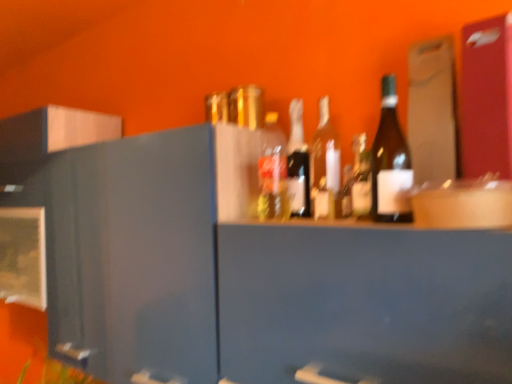
What do you see at coordinates (324, 164) in the screenshot? The height and width of the screenshot is (384, 512). I see `translucent glass bottle at center, which is counted as the 4th bottle, starting from the front` at bounding box center [324, 164].

Locate an element on the screen. matte glass bottle at center, positioned as the fifth bottle in back-to-front order is located at coordinates (361, 181).

The width and height of the screenshot is (512, 384). Identify the location of green glass bottle at upper right, positioned as the sixth bottle in back-to-front order. (390, 161).

Can you confirm if green glass bottle at upper right, positioned as the sixth bottle in back-to-front order, is thinner than matte glass bottle at center, positioned as the fifth bottle in back-to-front order?

Incorrect, the width of green glass bottle at upper right, positioned as the sixth bottle in back-to-front order, is not less than that of matte glass bottle at center, positioned as the fifth bottle in back-to-front order.

Is green glass bottle at upper right, positioned as the sixth bottle in back-to-front order, surrounding matte glass bottle at center, positioned as the 2th bottle in front-to-back order?

No, matte glass bottle at center, positioned as the 2th bottle in front-to-back order, is not inside green glass bottle at upper right, positioned as the sixth bottle in back-to-front order.

How many degrees apart are the facing directions of green glass bottle at upper right, the first bottle from the front, and matte glass bottle at center, positioned as the 2th bottle in front-to-back order?

The angular difference between green glass bottle at upper right, the first bottle from the front, and matte glass bottle at center, positioned as the 2th bottle in front-to-back order, is 4.16 degrees.

Between green glass bottle at upper right, positioned as the sixth bottle in back-to-front order, and matte glass bottle at center, positioned as the 2th bottle in front-to-back order, which one has larger size?

green glass bottle at upper right, positioned as the sixth bottle in back-to-front order.

From a real-world perspective, which is physically above, translucent glass bottle at center, the 2th bottle in the back-to-front sequence, or green glass bottle at upper right, positioned as the sixth bottle in back-to-front order?

green glass bottle at upper right, positioned as the sixth bottle in back-to-front order.

Which object is positioned more to the right, translucent glass bottle at center, placed as the 5th bottle when sorted from front to back, or green glass bottle at upper right, positioned as the sixth bottle in back-to-front order?

green glass bottle at upper right, positioned as the sixth bottle in back-to-front order.

Does point (259, 176) appear closer or farther from the camera than point (390, 97)?

Point (259, 176) is closer to the camera than point (390, 97).

Between translucent glass bottle at center, placed as the 5th bottle when sorted from front to back, and green glass bottle at upper right, the first bottle from the front, which one has larger size?

green glass bottle at upper right, the first bottle from the front.

From a real-world perspective, is translucent glass bottle at center, placed as the 3th bottle when sorted from back to front, beneath green glass bottle at upper right, the first bottle from the front?

No.

Consider the image. Which of these two, translucent glass bottle at center, which is counted as the 4th bottle, starting from the front, or green glass bottle at upper right, the first bottle from the front, stands taller?

Standing taller between the two is translucent glass bottle at center, which is counted as the 4th bottle, starting from the front.

What's the angular difference between translucent glass bottle at center, which is counted as the 4th bottle, starting from the front, and green glass bottle at upper right, the first bottle from the front,'s facing directions?

They differ by 4.22 degrees in their facing directions.

Is translucent glass bottle at center, placed as the 3th bottle when sorted from back to front, inside or outside of green glass bottle at upper right, the first bottle from the front?

translucent glass bottle at center, placed as the 3th bottle when sorted from back to front, lies outside green glass bottle at upper right, the first bottle from the front.

Is translucent glass bottle at center, the 2th bottle in the back-to-front sequence, facing away from matte glass bottle at center, which is counted as the third bottle, starting from the front?

No, translucent glass bottle at center, the 2th bottle in the back-to-front sequence, is not facing away from matte glass bottle at center, which is counted as the third bottle, starting from the front.

Which object is further away from the camera, translucent glass bottle at center, placed as the 5th bottle when sorted from front to back, or matte glass bottle at center, which is counted as the third bottle, starting from the front?

translucent glass bottle at center, placed as the 5th bottle when sorted from front to back, is further from the camera.

Which is behind, point (282, 194) or point (356, 138)?

Positioned behind is point (356, 138).

Considering the sizes of objects translucent glass bottle at center, the 6th bottle when ordered from front to back, and matte glass bottle at center, positioned as the fifth bottle in back-to-front order, in the image provided, who is shorter, translucent glass bottle at center, the 6th bottle when ordered from front to back, or matte glass bottle at center, positioned as the fifth bottle in back-to-front order,?

Standing shorter between the two is matte glass bottle at center, positioned as the fifth bottle in back-to-front order.

Is translucent glass bottle at center, the 6th bottle when ordered from front to back, to the right of matte glass bottle at center, positioned as the fifth bottle in back-to-front order, from the viewer's perspective?

Incorrect, translucent glass bottle at center, the 6th bottle when ordered from front to back, is not on the right side of matte glass bottle at center, positioned as the fifth bottle in back-to-front order.

Consider the image. Looking at their sizes, would you say translucent glass bottle at center, arranged as the 1th bottle when viewed from the back, is wider or thinner than matte glass bottle at center, positioned as the 2th bottle in front-to-back order?

Considering their sizes, translucent glass bottle at center, arranged as the 1th bottle when viewed from the back, looks broader than matte glass bottle at center, positioned as the 2th bottle in front-to-back order.

Which object is further away from the camera, translucent glass bottle at center, the 6th bottle when ordered from front to back, or matte glass bottle at center, positioned as the fifth bottle in back-to-front order?

translucent glass bottle at center, the 6th bottle when ordered from front to back.

From a real-world perspective, is matte glass bottle at center, positioned as the fifth bottle in back-to-front order, on top of translucent glass bottle at center, which is counted as the 4th bottle, starting from the front?

No, from a real-world perspective, matte glass bottle at center, positioned as the fifth bottle in back-to-front order, is not over translucent glass bottle at center, which is counted as the 4th bottle, starting from the front

Considering the relative sizes of matte glass bottle at center, positioned as the 2th bottle in front-to-back order, and translucent glass bottle at center, which is counted as the 4th bottle, starting from the front, in the image provided, is matte glass bottle at center, positioned as the 2th bottle in front-to-back order, wider than translucent glass bottle at center, which is counted as the 4th bottle, starting from the front,?

In fact, matte glass bottle at center, positioned as the 2th bottle in front-to-back order, might be narrower than translucent glass bottle at center, which is counted as the 4th bottle, starting from the front.

Which of these two, matte glass bottle at center, positioned as the 2th bottle in front-to-back order, or translucent glass bottle at center, placed as the 3th bottle when sorted from back to front, is smaller?

Smaller between the two is matte glass bottle at center, positioned as the 2th bottle in front-to-back order.

Based on their sizes in the image, would you say matte glass bottle at center, which is the fourth bottle from back to front, is bigger or smaller than matte glass bottle at center, positioned as the fifth bottle in back-to-front order?

Considering their sizes, matte glass bottle at center, which is the fourth bottle from back to front, takes up more space than matte glass bottle at center, positioned as the fifth bottle in back-to-front order.

Is matte glass bottle at center, which is counted as the third bottle, starting from the front, oriented away from matte glass bottle at center, positioned as the 2th bottle in front-to-back order?

No, matte glass bottle at center, positioned as the 2th bottle in front-to-back order, is not at the back of matte glass bottle at center, which is counted as the third bottle, starting from the front.

Is matte glass bottle at center, which is the fourth bottle from back to front, located outside matte glass bottle at center, positioned as the fifth bottle in back-to-front order?

That's correct, matte glass bottle at center, which is the fourth bottle from back to front, is outside of matte glass bottle at center, positioned as the fifth bottle in back-to-front order.

Locate an element on the screen. This screenshot has height=384, width=512. bottle in front of the matte glass bottle at center, positioned as the 2th bottle in front-to-back order is located at coordinates (390, 161).

Locate an element on the screen. The width and height of the screenshot is (512, 384). bottle that is the 2nd object located above the translucent glass bottle at center, the 2th bottle in the back-to-front sequence (from the image's perspective) is located at coordinates (390, 161).

Based on their spatial positions, is translucent glass bottle at center, placed as the 3th bottle when sorted from back to front, or matte glass bottle at center, positioned as the 2th bottle in front-to-back order, further from translucent glass bottle at center, placed as the 5th bottle when sorted from front to back?

Among the two, matte glass bottle at center, positioned as the 2th bottle in front-to-back order, is located further to translucent glass bottle at center, placed as the 5th bottle when sorted from front to back.

When comparing their distances from matte glass bottle at center, positioned as the 2th bottle in front-to-back order, does green glass bottle at upper right, positioned as the sixth bottle in back-to-front order, or matte glass bottle at center, which is counted as the third bottle, starting from the front, seem closer?

The object closer to matte glass bottle at center, positioned as the 2th bottle in front-to-back order, is matte glass bottle at center, which is counted as the third bottle, starting from the front.

Looking at the image, which one is located further to translucent glass bottle at center, the 2th bottle in the back-to-front sequence, translucent glass bottle at center, placed as the 3th bottle when sorted from back to front, or green glass bottle at upper right, the first bottle from the front?

Among the two, green glass bottle at upper right, the first bottle from the front, is located further to translucent glass bottle at center, the 2th bottle in the back-to-front sequence.

Based on the photo, considering their positions, is green glass bottle at upper right, the first bottle from the front, positioned further to translucent glass bottle at center, placed as the 5th bottle when sorted from front to back, than matte glass bottle at center, positioned as the fifth bottle in back-to-front order?

The object further to translucent glass bottle at center, placed as the 5th bottle when sorted from front to back, is green glass bottle at upper right, the first bottle from the front.

Which object lies further to the anchor point matte glass bottle at center, positioned as the fifth bottle in back-to-front order, matte glass bottle at center, which is counted as the third bottle, starting from the front, or translucent glass bottle at center, placed as the 3th bottle when sorted from back to front?

translucent glass bottle at center, placed as the 3th bottle when sorted from back to front, lies further to matte glass bottle at center, positioned as the fifth bottle in back-to-front order, than the other object.

Based on their spatial positions, is green glass bottle at upper right, positioned as the sixth bottle in back-to-front order, or matte glass bottle at center, positioned as the 2th bottle in front-to-back order, further from translucent glass bottle at center, arranged as the 1th bottle when viewed from the back?

green glass bottle at upper right, positioned as the sixth bottle in back-to-front order, lies further to translucent glass bottle at center, arranged as the 1th bottle when viewed from the back, than the other object.

Looking at the image, which one is located closer to translucent glass bottle at center, the 6th bottle when ordered from front to back, translucent glass bottle at center, placed as the 5th bottle when sorted from front to back, or matte glass bottle at center, positioned as the fifth bottle in back-to-front order?

translucent glass bottle at center, placed as the 5th bottle when sorted from front to back, lies closer to translucent glass bottle at center, the 6th bottle when ordered from front to back, than the other object.

Looking at the image, which one is located closer to matte glass bottle at center, positioned as the fifth bottle in back-to-front order, translucent glass bottle at center, arranged as the 1th bottle when viewed from the back, or matte glass bottle at center, which is the fourth bottle from back to front?

matte glass bottle at center, which is the fourth bottle from back to front, lies closer to matte glass bottle at center, positioned as the fifth bottle in back-to-front order, than the other object.

The image size is (512, 384). I want to click on bottle between green glass bottle at upper right, positioned as the sixth bottle in back-to-front order, and matte glass bottle at center, which is counted as the third bottle, starting from the front, from front to back, so click(x=361, y=181).

Find the location of a particular element. bottle between matte glass bottle at center, positioned as the fifth bottle in back-to-front order, and translucent glass bottle at center, placed as the 3th bottle when sorted from back to front, from front to back is located at coordinates (356, 183).

Find the location of a particular element. This screenshot has width=512, height=384. bottle between translucent glass bottle at center, placed as the 5th bottle when sorted from front to back, and translucent glass bottle at center, which is counted as the 4th bottle, starting from the front is located at coordinates (298, 163).